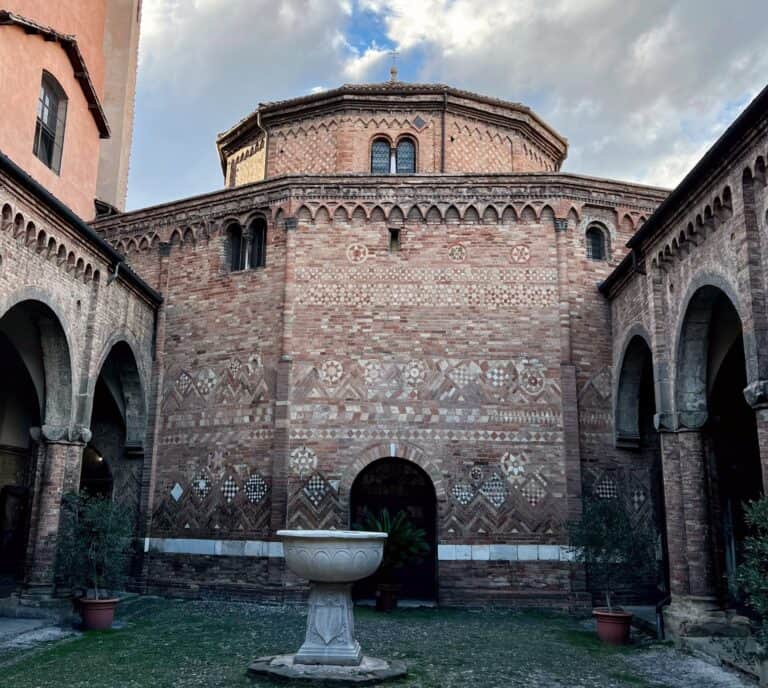
The height and width of the screenshot is (688, 768). Find the location of `brick column right side`. brick column right side is located at coordinates (689, 512).